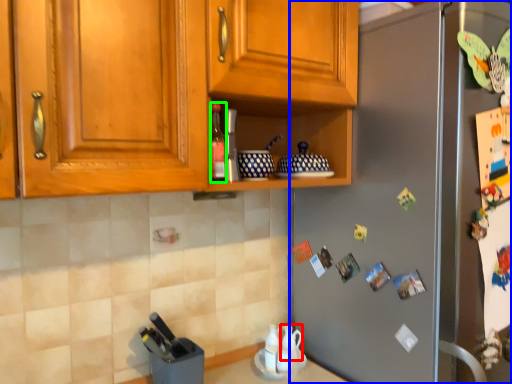
Question: Which object is the farthest from tea pot (highlighted by a red box)? Choose among these: refrigerator (highlighted by a blue box) or bottle (highlighted by a green box).

Choices:
 (A) refrigerator
 (B) bottle

Answer: (B)